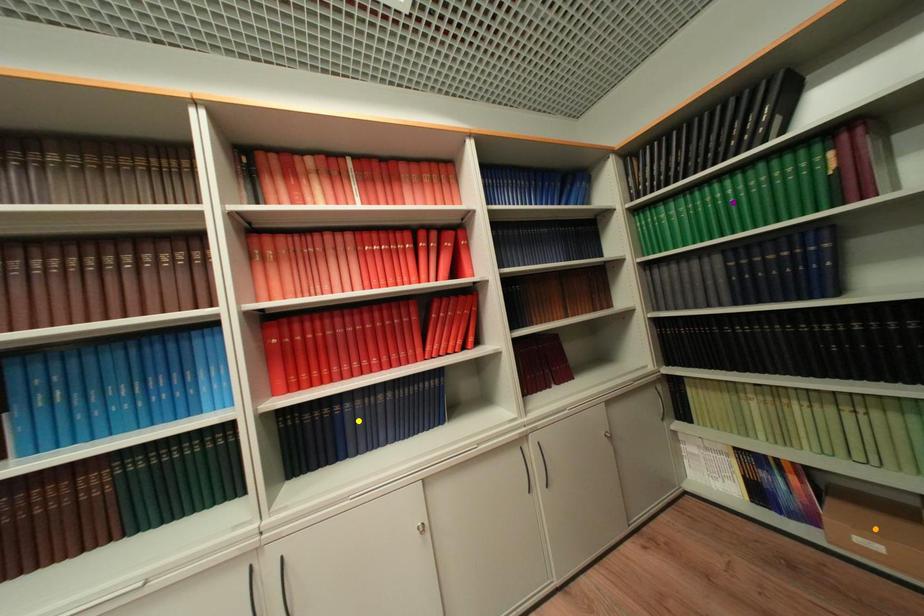
Order these from nearest to farthest:
purple point, yellow point, orange point

orange point, yellow point, purple point